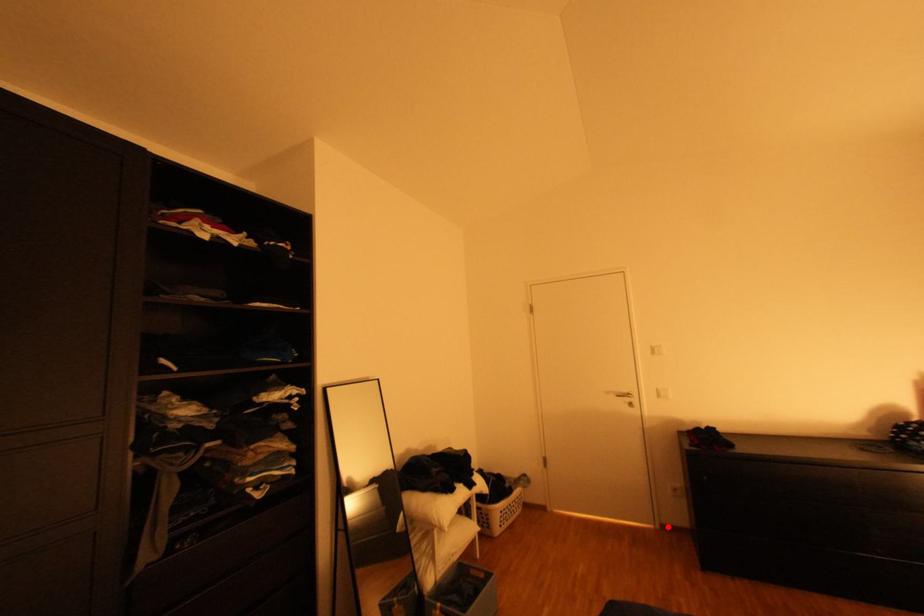
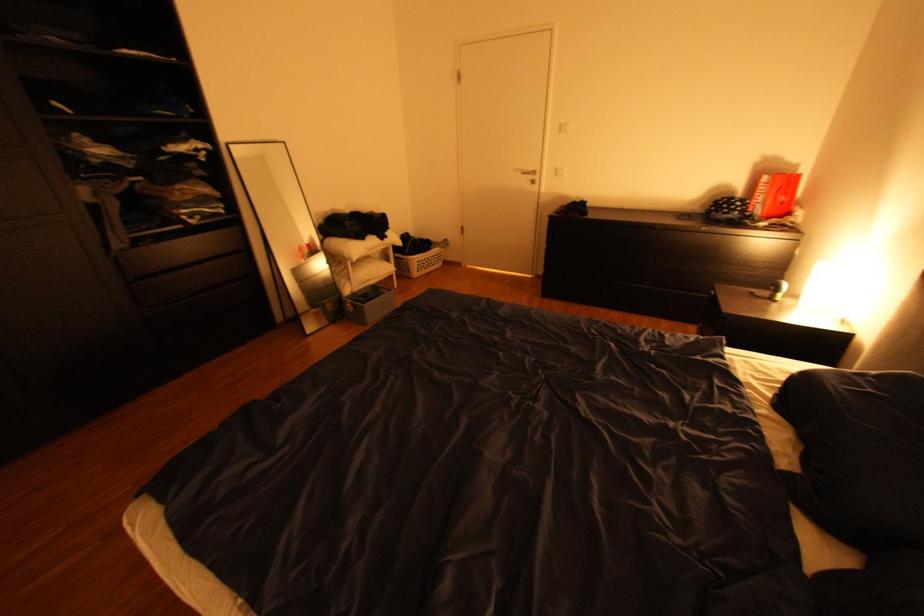
Where in the second image is the point corresponding to the highlighted location from the first image?

(543, 276)